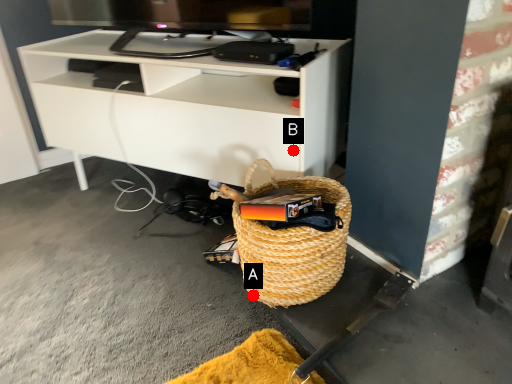
Question: Two points are circled on the image, labeled by A and B beside each circle. Which point is further to the camera?

Choices:
 (A) A is further
 (B) B is further

Answer: (B)